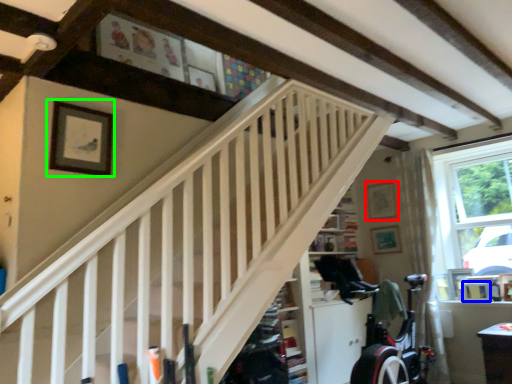
Question: Which object is positioned closest to picture frame (highlighted by a red box)? Select from picture frame (highlighted by a blue box) and picture frame (highlighted by a green box).

Choices:
 (A) picture frame
 (B) picture frame

Answer: (A)